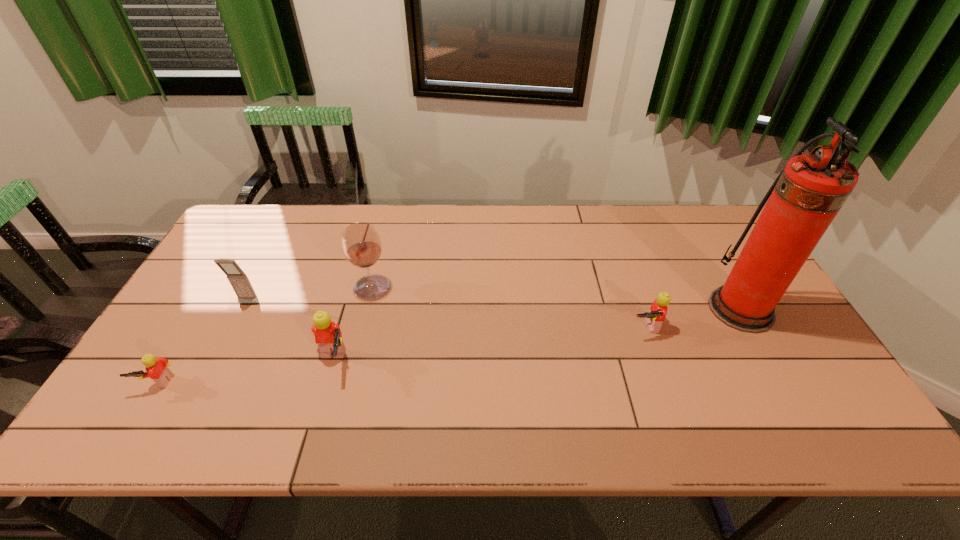
Locate an element on the screen. blank region between the tallest Lego and the cellular telephone is located at coordinates (291, 333).

Identify the location of free point between the wineglass and the fire extinguisher. (556, 298).

In order to click on empty location between the wineglass and the tallest object in this screenshot , I will do `click(556, 298)`.

This screenshot has width=960, height=540. Find the location of `vacant space in between the tallest object and the rightmost Lego`. vacant space in between the tallest object and the rightmost Lego is located at coordinates (692, 318).

This screenshot has width=960, height=540. Identify the location of free space between the rightmost object and the rightmost Lego. (692, 318).

Where is `empty space that is in between the fourth tallest object and the tallest object`? The height and width of the screenshot is (540, 960). empty space that is in between the fourth tallest object and the tallest object is located at coordinates (537, 335).

Where is `object that ranks as the third closest to the fire extinguisher`? object that ranks as the third closest to the fire extinguisher is located at coordinates (328, 336).

Where is `object that is the third nearest to the second tallest Lego`? The width and height of the screenshot is (960, 540). object that is the third nearest to the second tallest Lego is located at coordinates (328, 336).

Select which Lego appears as the second closest to the farthest Lego. Please provide its 2D coordinates. Your answer should be formatted as a tuple, i.e. [(x, y)], where the tuple contains the x and y coordinates of a point satisfying the conditions above.

[(157, 370)]

You are a GUI agent. You are given a task and a screenshot of the screen. Output one action in this format:
    pyautogui.click(x=<x>, y=<y>)
    Task: Click on the Lego object that ranks as the closest to the second shortest Lego
    The image size is (960, 540).
    Given the screenshot: What is the action you would take?
    pyautogui.click(x=328, y=336)